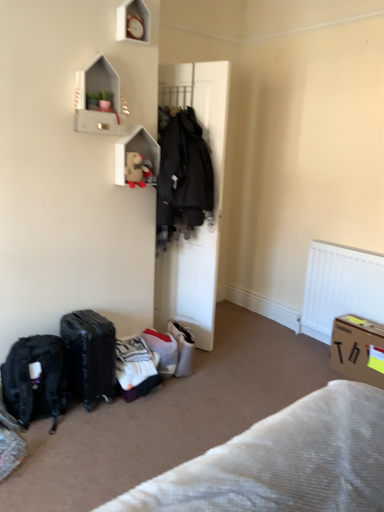
Locate an element on the screen. The image size is (384, 512). vacant area that lies in front of black matte backpack at lower left is located at coordinates (47, 460).